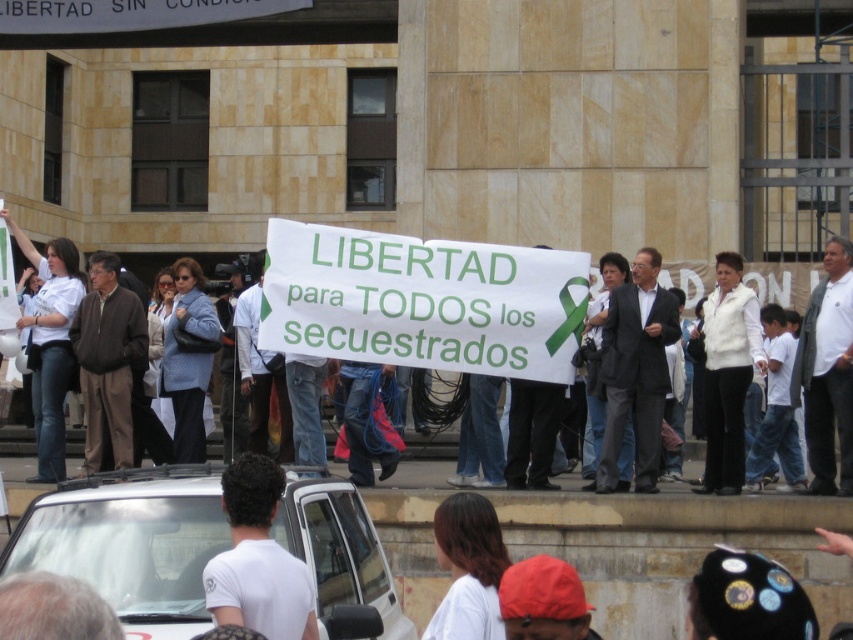
Can you confirm if white matte car at center is wider than white t-shirt at lower center?

Indeed, white matte car at center has a greater width compared to white t-shirt at lower center.

Which is more to the left, white matte car at center or white t-shirt at lower center?

From the viewer's perspective, white matte car at center appears more on the left side.

Which is in front, point (39, 497) or point (238, 576)?

Positioned in front is point (238, 576).

At what (x,y) coordinates should I click in order to perform the action: click on white matte car at center. Please return your answer as a coordinate pair (x, y). The height and width of the screenshot is (640, 853). Looking at the image, I should click on (x=131, y=544).